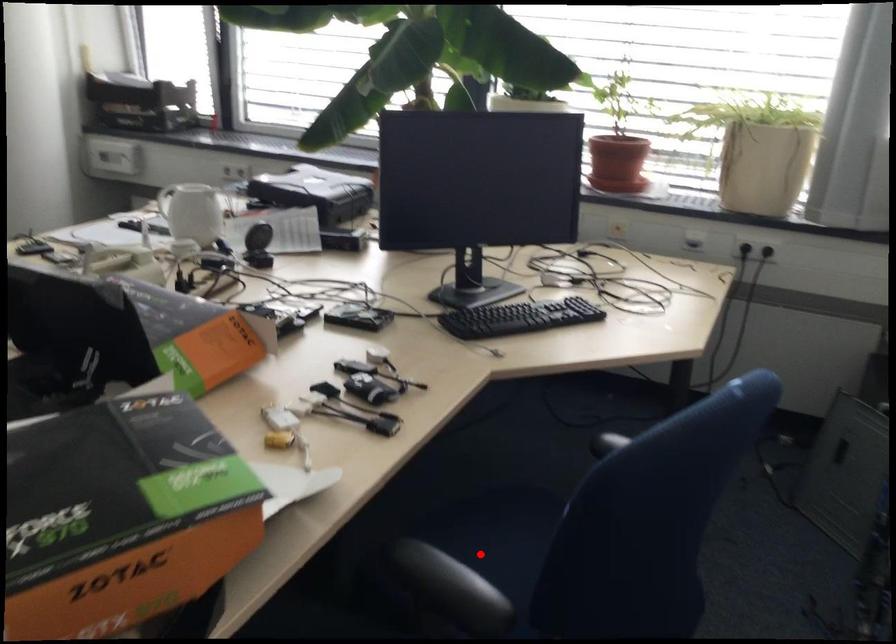
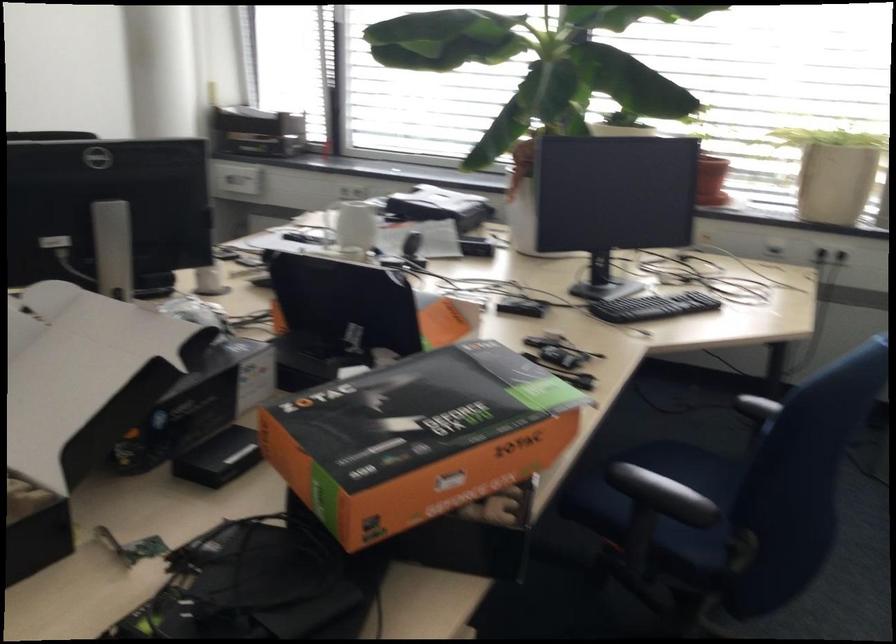
In the second image, find the point that corresponds to the highlighted location in the first image.

(659, 484)